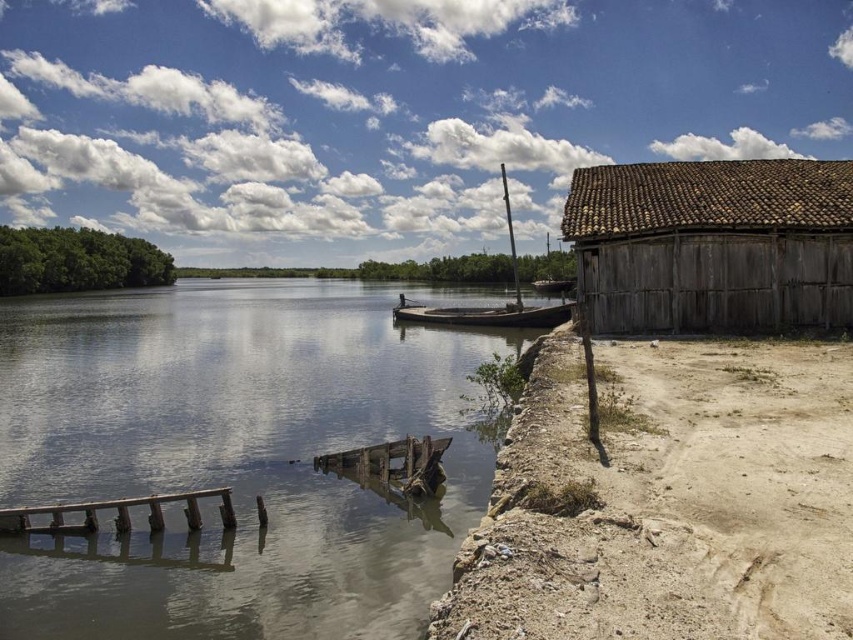
You are a boat operator who needs to move a 10 meter long cargo from the rusty wood dock at lower center to the brown tiled roof at right. Can you transport the cargo in one piece without breaking it?

The distance between the brown tiled roof at right and the rusty wood dock at lower center is 12.08 meters. Since the cargo is 10 meters long, it can be transported in one piece as the distance is sufficient to accommodate its length.

Based on the photo, you are standing at the point labeled point [393,456] and want to walk to the point labeled point [83,506]. Which direction should you move to reach your destination?

You should move forward because point [83,506] is in front of point [393,456].